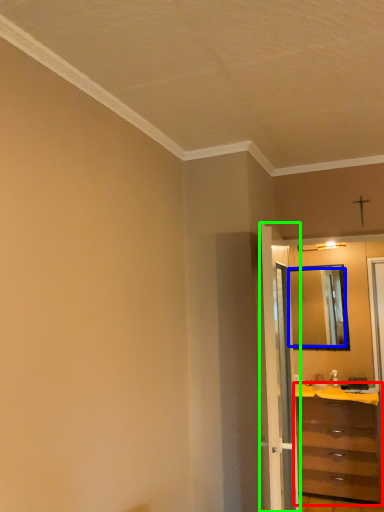
Question: Considering the real-world distances, which object is farthest from chest of drawers (highlighted by a red box)? mirror (highlighted by a blue box) or door (highlighted by a green box)?

Choices:
 (A) mirror
 (B) door

Answer: (B)